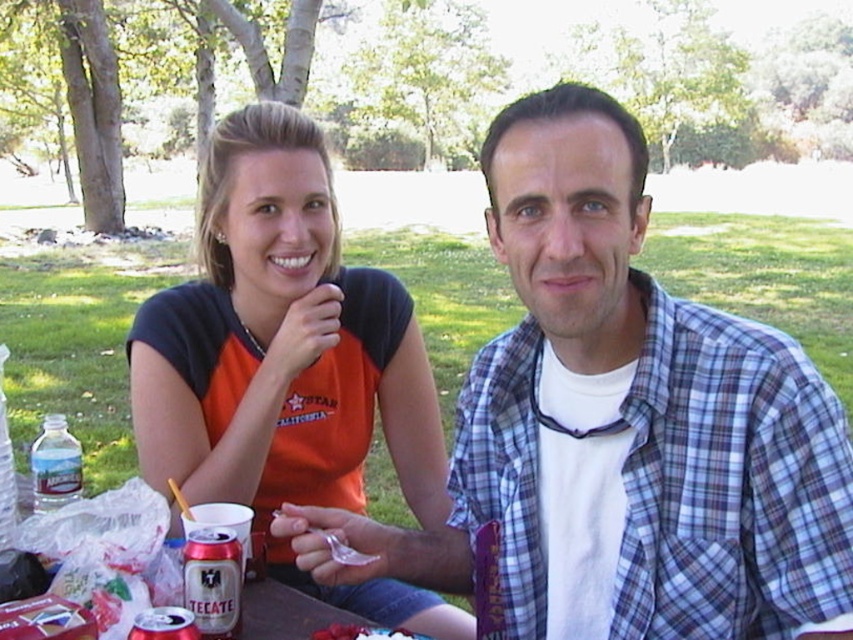
Is point (329, 404) less distant than point (44, 477)?

No, (329, 404) is behind (44, 477).

Does point (167, 314) come behind point (78, 461)?

Yes, point (167, 314) is farther from viewer.

Is point (325, 461) positioned behind point (38, 442)?

That is True.

I want to click on orange fabric shirt at upper left, so click(x=280, y=342).

Based on the photo, does plaid cotton shirt at center have a larger size compared to silver metallic can at lower left?

Correct, plaid cotton shirt at center is larger in size than silver metallic can at lower left.

Consider the image. Does plaid cotton shirt at center have a lesser width compared to silver metallic can at lower left?

Incorrect, plaid cotton shirt at center's width is not less than silver metallic can at lower left's.

Which is behind, point (634, 332) or point (219, 636)?

The point (634, 332) is behind.

Identify the location of plaid cotton shirt at center. (618, 428).

Which is behind, point (572, 177) or point (234, 371)?

Positioned behind is point (234, 371).

I want to click on plaid cotton shirt at center, so click(618, 428).